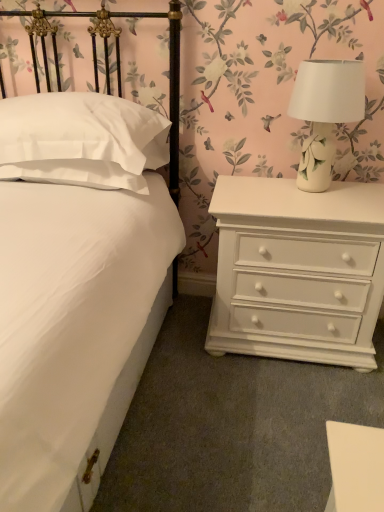
Find the location of a particular element. free space in front of white ceramic lamp at upper right is located at coordinates 326,206.